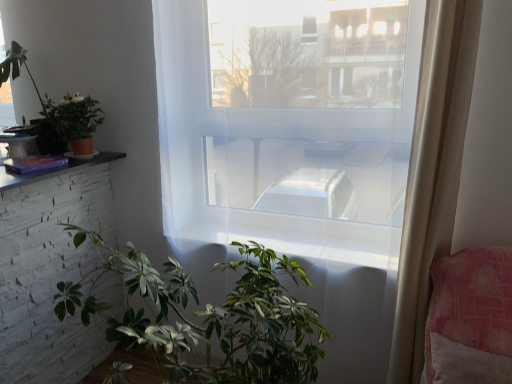
Question: Is green matte plant at upper left, placed as the 2th houseplant when sorted from right to left, to the right of green matte plant at lower center, which is counted as the 3th houseplant, starting from the left, from the viewer's perspective?

Choices:
 (A) no
 (B) yes

Answer: (A)

Question: Is green matte plant at upper left, placed as the 2th houseplant when sorted from right to left, with green matte plant at lower center, which is counted as the 3th houseplant, starting from the left?

Choices:
 (A) yes
 (B) no

Answer: (B)

Question: Is green matte plant at upper left, placed as the second houseplant when sorted from bottom to top, closer to the viewer compared to green matte plant at lower center, which ranks as the first houseplant in right-to-left order?

Choices:
 (A) no
 (B) yes

Answer: (A)

Question: From a real-world perspective, is green matte plant at upper left, placed as the second houseplant when sorted from bottom to top, beneath green matte plant at lower center, which ranks as the first houseplant in right-to-left order?

Choices:
 (A) no
 (B) yes

Answer: (A)

Question: Considering the relative positions of green matte plant at upper left, which is the second houseplant from left to right, and green matte plant at lower center, acting as the first houseplant starting from the bottom, in the image provided, is green matte plant at upper left, which is the second houseplant from left to right, behind green matte plant at lower center, acting as the first houseplant starting from the bottom,?

Choices:
 (A) yes
 (B) no

Answer: (A)

Question: Can you confirm if green matte plant at upper left, which is the second houseplant from left to right, is bigger than green matte plant at lower center, acting as the first houseplant starting from the bottom?

Choices:
 (A) yes
 (B) no

Answer: (B)

Question: Can you confirm if green matte plant at upper left, placed as the 2th houseplant when sorted from right to left, is thinner than matte white table at left?

Choices:
 (A) yes
 (B) no

Answer: (A)

Question: Would you say green matte plant at upper left, placed as the second houseplant when sorted from bottom to top, contains matte white table at left?

Choices:
 (A) no
 (B) yes

Answer: (A)

Question: Is green matte plant at upper left, placed as the second houseplant when sorted from bottom to top, smaller than matte white table at left?

Choices:
 (A) no
 (B) yes

Answer: (B)

Question: Could you tell me if green matte plant at upper left, positioned as the second houseplant in top-to-bottom order, is turned towards matte white table at left?

Choices:
 (A) yes
 (B) no

Answer: (B)

Question: Would you say green matte plant at upper left, positioned as the second houseplant in top-to-bottom order, is outside matte white table at left?

Choices:
 (A) yes
 (B) no

Answer: (A)

Question: Can you see green matte plant at upper left, which is the second houseplant from left to right, touching matte white table at left?

Choices:
 (A) no
 (B) yes

Answer: (A)

Question: From the image's perspective, would you say matte white table at left is shown under green matte plant at lower center, which ranks as the first houseplant in right-to-left order?

Choices:
 (A) yes
 (B) no

Answer: (B)